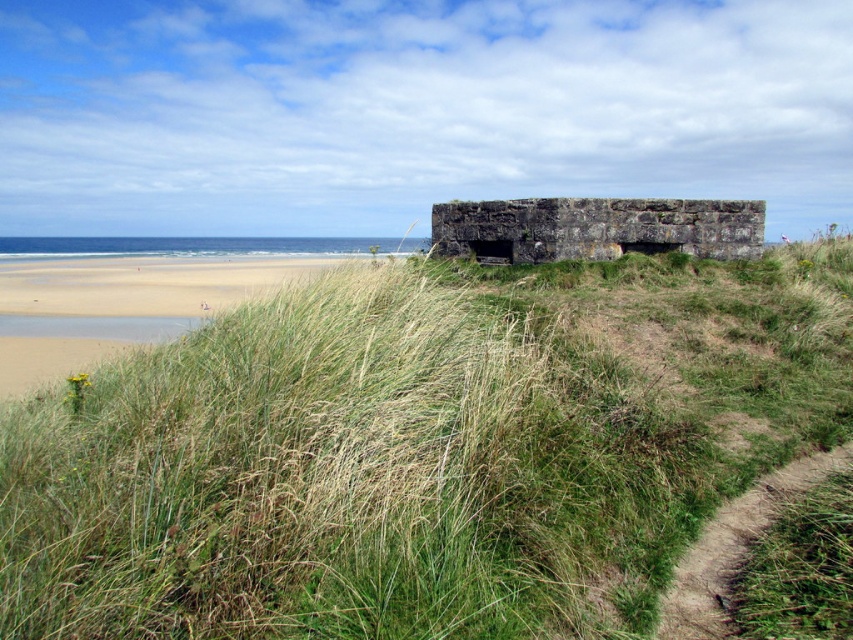
Can you confirm if green grassy at center is bigger than dirt/grass path at lower right?

Incorrect, green grassy at center is not larger than dirt/grass path at lower right.

Is point (424, 468) behind point (837, 449)?

No, (424, 468) is closer to viewer.

Does point (675, 300) come farther from viewer compared to point (682, 634)?

Yes, point (675, 300) is behind point (682, 634).

Locate an element on the screen. The image size is (853, 640). green grassy at center is located at coordinates (x=422, y=451).

Which is below, sandy beige sand at lower left or dirt/grass path at lower right?

Positioned lower is dirt/grass path at lower right.

Is sandy beige sand at lower left taller than dirt/grass path at lower right?

Yes.

Where is `sandy beige sand at lower left`? Image resolution: width=853 pixels, height=640 pixels. sandy beige sand at lower left is located at coordinates (148, 282).

Is green grassy at center above dark gray stone bunker at center?

Actually, green grassy at center is below dark gray stone bunker at center.

Consider the image. Is green grassy at center taller than dark gray stone bunker at center?

In fact, green grassy at center may be shorter than dark gray stone bunker at center.

Where is `green grassy at center`? green grassy at center is located at coordinates (422, 451).

Where is `green grassy at center`? green grassy at center is located at coordinates (422, 451).